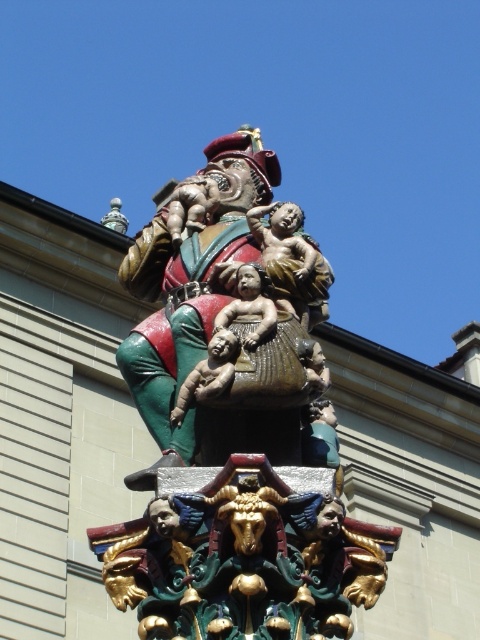
From the picture: You are standing at the base of the sculpture and want to take a photo of the point at coordinates [271,420]. If your camera has a maximum zoom range of 35 meters, will you be able to capture the point clearly?

The point at coordinates [271,420] is 37.93 meters away from the viewer. Since the camera can only zoom up to 35 meters, it won not be able to capture the point clearly.

You are an art conservator assessing the sculpture. You notice that the polychrome wood carving at center and the matte brown baby at center require protective coatings. Given their sizes, which object will require a larger amount of coating material?

The polychrome wood carving at center is larger in size than the matte brown baby at center, so it will require a larger amount of coating material.

You are an art conservator working on a restoration project. You need to move a 6 feet long ladder to reach both the polychrome wood carving at center and the bronze statue at center. Based on the distance between them, will the ladder be long enough to cover both objects without needing to move it?

The distance between the polychrome wood carving at center and the bronze statue at center is 5.55 feet. Since the ladder is 6 feet long, it will be sufficient to cover both objects without needing to move it.